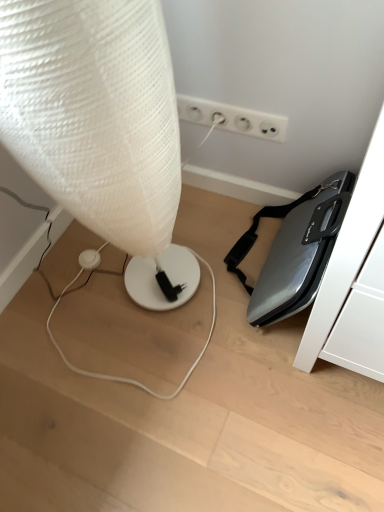
Locate an element on the screen. Image resolution: width=384 pixels, height=512 pixels. white textured lamp at left is located at coordinates (95, 113).

What is the approximate height of white textured lamp at left?

white textured lamp at left is 86.54 centimeters in height.

This screenshot has height=512, width=384. What do you see at coordinates (95, 113) in the screenshot?
I see `white textured lamp at left` at bounding box center [95, 113].

Describe the element at coordinates (232, 118) in the screenshot. Image resolution: width=384 pixels, height=512 pixels. I see `white plastic electrical outlet at upper center` at that location.

You are a GUI agent. You are given a task and a screenshot of the screen. Output one action in this format:
    pyautogui.click(x=<x>, y=<y>)
    Task: Click on the white plastic electrical outlet at upper center
    The image size is (384, 512).
    Given the screenshot: What is the action you would take?
    pyautogui.click(x=232, y=118)

You are a GUI agent. You are given a task and a screenshot of the screen. Output one action in this format:
    pyautogui.click(x=<x>, y=<y>)
    Task: Click on the white textured lamp at left
    
    Given the screenshot: What is the action you would take?
    pyautogui.click(x=95, y=113)

Does white plastic electrical outlet at upper center appear on the right side of white textured lamp at left?

Yes, white plastic electrical outlet at upper center is to the right of white textured lamp at left.

Is white plastic electrical outlet at upper center behind white textured lamp at left?

Yes, white plastic electrical outlet at upper center is further from the camera.

Considering the positions of point (259, 129) and point (111, 146), is point (259, 129) closer or farther from the camera than point (111, 146)?

Point (259, 129) is positioned farther from the camera compared to point (111, 146).

From the image's perspective, is white plastic electrical outlet at upper center located above or below white textured lamp at left?

white plastic electrical outlet at upper center is above white textured lamp at left.

From a real-world perspective, relative to white textured lamp at left, is white plastic electrical outlet at upper center vertically above or below?

white plastic electrical outlet at upper center is situated lower than white textured lamp at left in the real world.

Considering the relative sizes of white plastic electrical outlet at upper center and white textured lamp at left in the image provided, is white plastic electrical outlet at upper center thinner than white textured lamp at left?

Correct, the width of white plastic electrical outlet at upper center is less than that of white textured lamp at left.

Does white plastic electrical outlet at upper center have a lesser height compared to white textured lamp at left?

Yes, white plastic electrical outlet at upper center is shorter than white textured lamp at left.

Can you confirm if white plastic electrical outlet at upper center is smaller than white textured lamp at left?

Correct, white plastic electrical outlet at upper center occupies less space than white textured lamp at left.

Is white plastic electrical outlet at upper center positioned beyond the bounds of white textured lamp at left?

Yes, white plastic electrical outlet at upper center is located beyond the bounds of white textured lamp at left.

Does white plastic electrical outlet at upper center touch white textured lamp at left?

white plastic electrical outlet at upper center and white textured lamp at left are clearly separated.

Is white plastic electrical outlet at upper center positioned with its back to white textured lamp at left?

No, white plastic electrical outlet at upper center's orientation is not away from white textured lamp at left.

How many degrees apart are the facing directions of white plastic electrical outlet at upper center and white textured lamp at left?

1.03 degrees.

Where is `electric outlet that is under the white textured lamp at left (from a real-world perspective)`? This screenshot has width=384, height=512. electric outlet that is under the white textured lamp at left (from a real-world perspective) is located at coordinates (232, 118).

Does white textured lamp at left appear on the right side of white plastic electrical outlet at upper center?

Incorrect, white textured lamp at left is not on the right side of white plastic electrical outlet at upper center.

Which is behind, white textured lamp at left or white plastic electrical outlet at upper center?

white plastic electrical outlet at upper center is more distant.

Which is closer, (55, 20) or (178, 103)?

Point (55, 20) appears to be closer to the viewer than point (178, 103).

From the image's perspective, is white textured lamp at left above or below white plastic electrical outlet at upper center?

white textured lamp at left is situated lower than white plastic electrical outlet at upper center in the image.

From a real-world perspective, is white textured lamp at left located beneath white plastic electrical outlet at upper center?

No, from a real-world perspective, white textured lamp at left is not beneath white plastic electrical outlet at upper center.

Is white textured lamp at left wider or thinner than white plastic electrical outlet at upper center?

Considering their sizes, white textured lamp at left looks broader than white plastic electrical outlet at upper center.

Which of these two, white textured lamp at left or white plastic electrical outlet at upper center, stands shorter?

white plastic electrical outlet at upper center is shorter.

Is white textured lamp at left smaller than white plastic electrical outlet at upper center?

No.

Could white plastic electrical outlet at upper center be considered to be inside white textured lamp at left?

No.

Is white textured lamp at left far from white plastic electrical outlet at upper center?

white textured lamp at left is actually quite close to white plastic electrical outlet at upper center.

Looking at this image, is white textured lamp at left facing towards white plastic electrical outlet at upper center?

No, white textured lamp at left is not facing towards white plastic electrical outlet at upper center.

Can you tell me how much white textured lamp at left and white plastic electrical outlet at upper center differ in facing direction?

There is a 1.03-degree angle between the facing directions of white textured lamp at left and white plastic electrical outlet at upper center.

Find the location of a particular element. electric outlet located on the right of white textured lamp at left is located at coordinates (232, 118).

This screenshot has width=384, height=512. I want to click on electric outlet below the white textured lamp at left (from a real-world perspective), so click(232, 118).

Where is `lamp positioned vertically above the white plastic electrical outlet at upper center (from a real-world perspective)`? Image resolution: width=384 pixels, height=512 pixels. lamp positioned vertically above the white plastic electrical outlet at upper center (from a real-world perspective) is located at coordinates click(x=95, y=113).